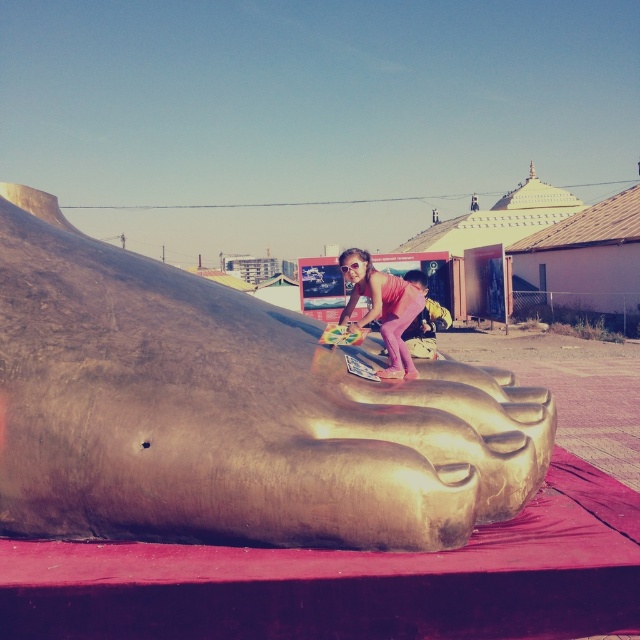
Does point (240, 353) lie in front of point (352, 275)?

Yes, point (240, 353) is in front of point (352, 275).

Can you confirm if gold metallic foot at center is positioned to the right of pink matte pants at center?

No, gold metallic foot at center is not to the right of pink matte pants at center.

Who is more distant from viewer, (260,355) or (416,308)?

The point (416,308) is more distant.

Locate an element on the screen. This screenshot has height=640, width=640. gold metallic foot at center is located at coordinates (227, 413).